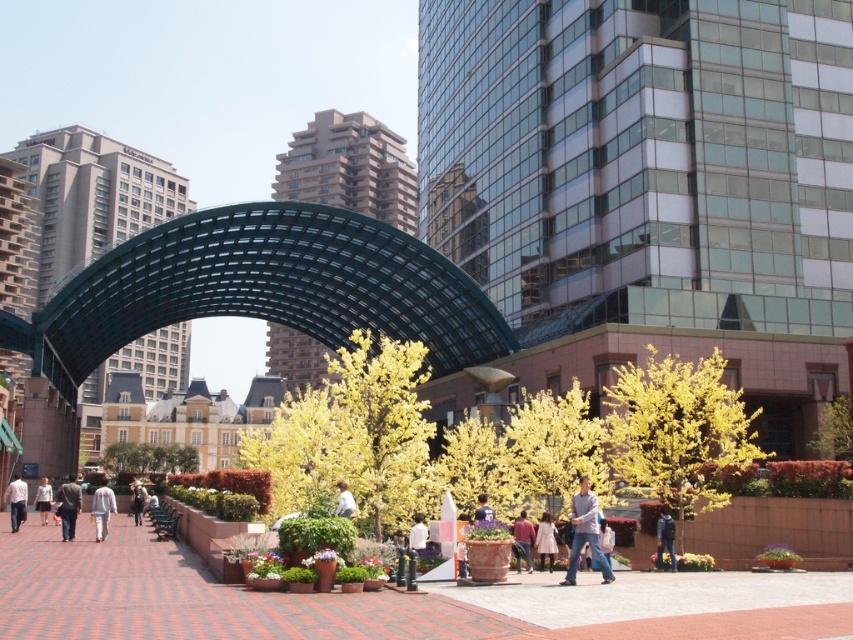
You are standing at the entrance of the plaza and notice a light gray cotton shirt at center. Based on its position, can you determine if it is closer to the arched canopy structure or the yellow flowering trees?

The light gray cotton shirt at center is located at point coordinates that place it closer to the arched canopy structure than the yellow flowering trees.

You are a photographer standing at the edge of the plaza. You want to take a photo of both the dark gray suit at center and the dark blue jacket at center. Since you have a wide angle lens, which subject would you need to focus on first to ensure both are in frame?

The dark gray suit at center is wider than the dark blue jacket at center, so you should focus on the dark gray suit at center first to ensure both are in frame.

You are standing in the plaza and want to reach the point marked at coordinates point (608, 566). If your walking speed is 1.5 meters per second, how long will it take you to reach that point?

The point (608, 566) is 37.88 meters away from the viewer. At a walking speed of 1.5 meters per second, it will take approximately 25.25 seconds to reach it.